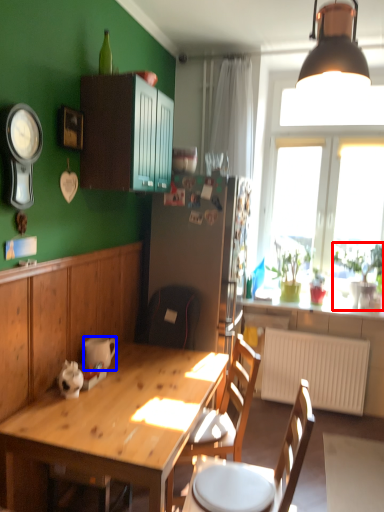
Question: Which of the following is the farthest to the observer, houseplant (highlighted by a red box) or coffee cup (highlighted by a blue box)?

Choices:
 (A) houseplant
 (B) coffee cup

Answer: (A)